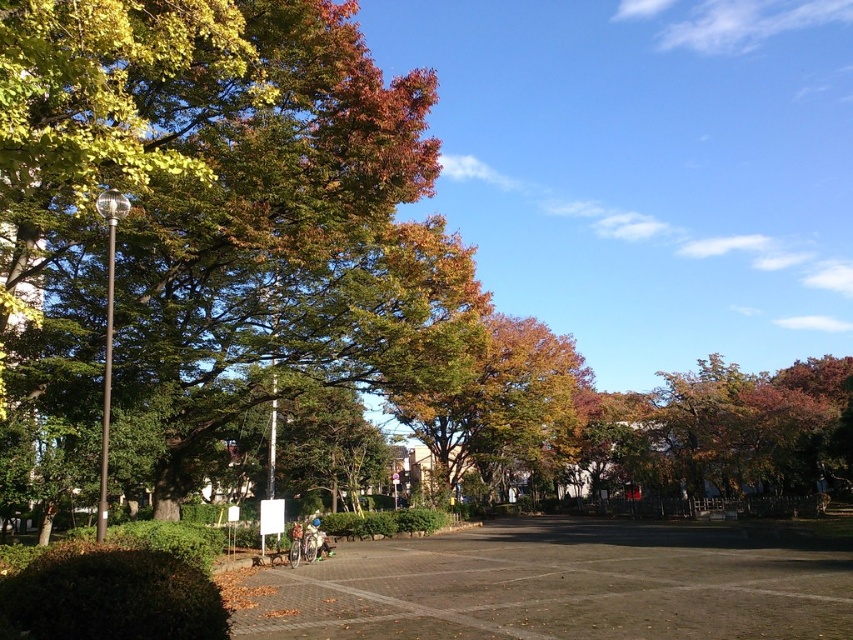
Question: Which point is farther to the camera?

Choices:
 (A) golden-brown foliage at center
 (B) green leafy tree at left
 (C) gray concrete parking lot at center

Answer: (A)

Question: Is gray concrete parking lot at center positioned behind golden-brown foliage at center?

Choices:
 (A) yes
 (B) no

Answer: (B)

Question: Which object appears closest to the camera in this image?

Choices:
 (A) gray concrete parking lot at center
 (B) golden-brown foliage at center
 (C) green leafy tree at left

Answer: (C)

Question: Which of the following is the farthest from the observer?

Choices:
 (A) gray concrete parking lot at center
 (B) green leafy tree at left
 (C) golden-brown foliage at center

Answer: (C)

Question: Can you confirm if gray concrete parking lot at center is positioned to the right of golden-brown foliage at center?

Choices:
 (A) no
 (B) yes

Answer: (B)

Question: Is gray concrete parking lot at center bigger than golden-brown foliage at center?

Choices:
 (A) no
 (B) yes

Answer: (A)